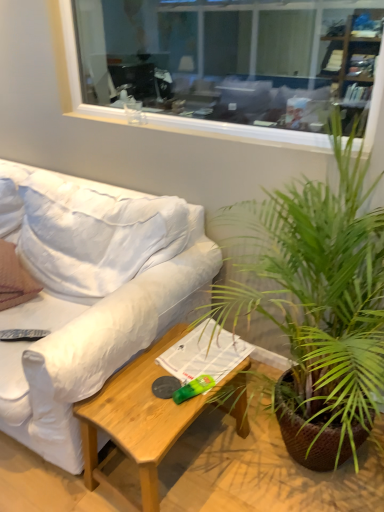
The width and height of the screenshot is (384, 512). What do you see at coordinates (22, 334) in the screenshot?
I see `black plastic remote control at lower left` at bounding box center [22, 334].

In order to face white fabric couch at left, should I rotate leftwards or rightwards?

It's best to rotate left around 23.711 degrees.

At what (x,y) coordinates should I click in order to perform the action: click on light brown wood coffee table at lower center. Please return your answer as a coordinate pair (x, y). This screenshot has height=512, width=384. Looking at the image, I should click on (136, 421).

Describe the element at coordinates (14, 279) in the screenshot. This screenshot has width=384, height=512. I see `brown textured pillow at left` at that location.

The width and height of the screenshot is (384, 512). I want to click on black plastic remote control at lower left, so click(x=22, y=334).

What's the angular difference between light brown wood coffee table at lower center and green leafy plant at center-right's facing directions?

The angle between the facing direction of light brown wood coffee table at lower center and the facing direction of green leafy plant at center-right is 5.43 degrees.

Can you confirm if light brown wood coffee table at lower center is bigger than green leafy plant at center-right?

No.

Identify the location of coffee table behind the green leafy plant at center-right. (136, 421).

Is light brown wood coffee table at lower center positioned beyond the bounds of green leafy plant at center-right?

No, light brown wood coffee table at lower center is inside green leafy plant at center-right's boundary.

I want to click on pillow above the green leafy plant at center-right (from the image's perspective), so click(14, 279).

Which is more to the right, brown textured pillow at left or green leafy plant at center-right?

From the viewer's perspective, green leafy plant at center-right appears more on the right side.

From a real-world perspective, who is located lower, brown textured pillow at left or green leafy plant at center-right?

brown textured pillow at left is physically lower.

Considering the relative positions of light brown wood coffee table at lower center and brown textured pillow at left in the image provided, is light brown wood coffee table at lower center to the left of brown textured pillow at left from the viewer's perspective?

In fact, light brown wood coffee table at lower center is to the right of brown textured pillow at left.

How many degrees apart are the facing directions of light brown wood coffee table at lower center and brown textured pillow at left?

There is a 22.6-degree angle between the facing directions of light brown wood coffee table at lower center and brown textured pillow at left.

From the image's perspective, is light brown wood coffee table at lower center positioned above or below brown textured pillow at left?

From the image's perspective, light brown wood coffee table at lower center appears below brown textured pillow at left.

Is light brown wood coffee table at lower center touching brown textured pillow at left?

No, light brown wood coffee table at lower center is not in contact with brown textured pillow at left.

From the image's perspective, relative to white fabric couch at left, is brown textured pillow at left above or below?

Based on their image positions, brown textured pillow at left is located above white fabric couch at left.

Does brown textured pillow at left turn towards white fabric couch at left?

Yes, brown textured pillow at left faces towards white fabric couch at left.

Which of these two, brown textured pillow at left or white fabric couch at left, stands shorter?

brown textured pillow at left.

From the picture: Would you say light brown wood coffee table at lower center is outside black plastic remote control at lower left?

Yes, light brown wood coffee table at lower center is outside of black plastic remote control at lower left.

Between light brown wood coffee table at lower center and black plastic remote control at lower left, which one appears on the left side from the viewer's perspective?

From the viewer's perspective, black plastic remote control at lower left appears more on the left side.

Looking at this image, considering the relative sizes of light brown wood coffee table at lower center and black plastic remote control at lower left in the image provided, is light brown wood coffee table at lower center smaller than black plastic remote control at lower left?

Actually, light brown wood coffee table at lower center might be larger than black plastic remote control at lower left.

Considering the positions of point (109, 94) and point (16, 383), is point (109, 94) closer or farther from the camera than point (16, 383)?

Point (109, 94) is positioned farther from the camera compared to point (16, 383).

The image size is (384, 512). What are the coordinates of `studio couch in front of the clear glass window at upper center` in the screenshot? It's located at (91, 298).

Is clear glass window at upper center directly adjacent to white fabric couch at left?

No, clear glass window at upper center is not with white fabric couch at left.

Is brown textured pillow at left not within black plastic remote control at lower left?

Yes, brown textured pillow at left is located beyond the bounds of black plastic remote control at lower left.

Considering the relative sizes of brown textured pillow at left and black plastic remote control at lower left in the image provided, is brown textured pillow at left bigger than black plastic remote control at lower left?

Yes.

Considering the sizes of brown textured pillow at left and black plastic remote control at lower left in the image, is brown textured pillow at left wider or thinner than black plastic remote control at lower left?

Considering their sizes, brown textured pillow at left looks slimmer than black plastic remote control at lower left.

Can you tell me how much brown textured pillow at left and black plastic remote control at lower left differ in facing direction?

15 degrees separate the facing orientations of brown textured pillow at left and black plastic remote control at lower left.

You are a GUI agent. You are given a task and a screenshot of the screen. Output one action in this format:
    pyautogui.click(x=<x>, y=<y>)
    Task: Click on the coffee table below the green leafy plant at center-right (from the image's perspective)
    
    Given the screenshot: What is the action you would take?
    pyautogui.click(x=136, y=421)

Identify the location of pillow above the green leafy plant at center-right (from the image's perspective). (14, 279).

Looking at the image, which one is located closer to green leafy plant at center-right, brown textured pillow at left or black plastic remote control at lower left?

Based on the image, black plastic remote control at lower left appears to be nearer to green leafy plant at center-right.

Considering their positions, is light brown wood coffee table at lower center positioned closer to white fabric couch at left than brown textured pillow at left?

light brown wood coffee table at lower center.

Considering their positions, is light brown wood coffee table at lower center positioned closer to brown textured pillow at left than clear glass window at upper center?

The object closer to brown textured pillow at left is light brown wood coffee table at lower center.

Looking at the image, which one is located closer to white fabric couch at left, black plastic remote control at lower left or clear glass window at upper center?

Among the two, black plastic remote control at lower left is located nearer to white fabric couch at left.

Considering their positions, is green leafy plant at center-right positioned closer to brown textured pillow at left than clear glass window at upper center?

Among the two, green leafy plant at center-right is located nearer to brown textured pillow at left.

When comparing their distances from white fabric couch at left, does brown textured pillow at left or black plastic remote control at lower left seem closer?

brown textured pillow at left is closer to white fabric couch at left.

When comparing their distances from green leafy plant at center-right, does light brown wood coffee table at lower center or clear glass window at upper center seem closer?

light brown wood coffee table at lower center lies closer to green leafy plant at center-right than the other object.

When comparing their distances from brown textured pillow at left, does green leafy plant at center-right or white fabric couch at left seem closer?

white fabric couch at left.

Image resolution: width=384 pixels, height=512 pixels. What are the coordinates of `studio couch between clear glass window at upper center and light brown wood coffee table at lower center in the vertical direction` in the screenshot? It's located at (91, 298).

Find the location of a particular element. The image size is (384, 512). houseplant that lies between clear glass window at upper center and black plastic remote control at lower left from top to bottom is located at coordinates (317, 303).

Identify the location of coffee table between white fabric couch at left and green leafy plant at center-right in the horizontal direction. (136, 421).

This screenshot has width=384, height=512. In order to click on pillow between white fabric couch at left and clear glass window at upper center in this screenshot , I will do `click(14, 279)`.